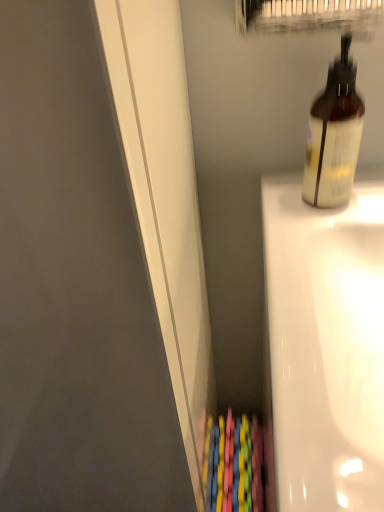
Image resolution: width=384 pixels, height=512 pixels. What do you see at coordinates (334, 136) in the screenshot?
I see `translucent plastic bottle at upper right` at bounding box center [334, 136].

Find the location of `translucent plastic bottle at upper right`. translucent plastic bottle at upper right is located at coordinates point(334,136).

Describe the element at coordinates (326, 346) in the screenshot. I see `white glossy bathtub at right` at that location.

At what (x,y) coordinates should I click in order to perform the action: click on white glossy bathtub at right. Please return your answer as a coordinate pair (x, y). Looking at the image, I should click on (326, 346).

The width and height of the screenshot is (384, 512). In order to click on translucent plastic bottle at upper right in this screenshot , I will do `click(334, 136)`.

Between translucent plastic bottle at upper right and white glossy bathtub at right, which one appears on the left side from the viewer's perspective?

Positioned to the left is translucent plastic bottle at upper right.

Which object is closer to the camera, translucent plastic bottle at upper right or white glossy bathtub at right?

white glossy bathtub at right is more forward.

Considering the points (331, 71) and (368, 359), which point is in front, point (331, 71) or point (368, 359)?

Positioned in front is point (368, 359).

From the image's perspective, which object appears higher, translucent plastic bottle at upper right or white glossy bathtub at right?

translucent plastic bottle at upper right appears higher in the image.

From a real-world perspective, which is physically below, translucent plastic bottle at upper right or white glossy bathtub at right?

From a 3D spatial view, white glossy bathtub at right is below.

Considering the relative sizes of translucent plastic bottle at upper right and white glossy bathtub at right in the image provided, is translucent plastic bottle at upper right thinner than white glossy bathtub at right?

Yes, translucent plastic bottle at upper right is thinner than white glossy bathtub at right.

From their relative heights in the image, would you say translucent plastic bottle at upper right is taller or shorter than white glossy bathtub at right?

Considering their sizes, translucent plastic bottle at upper right has less height than white glossy bathtub at right.

Looking at this image, who is bigger, translucent plastic bottle at upper right or white glossy bathtub at right?

With larger size is white glossy bathtub at right.

Is white glossy bathtub at right surrounded by translucent plastic bottle at upper right?

No.

Are translucent plastic bottle at upper right and white glossy bathtub at right making contact?

No, translucent plastic bottle at upper right is not touching white glossy bathtub at right.

Is translucent plastic bottle at upper right oriented towards white glossy bathtub at right?

No, translucent plastic bottle at upper right does not turn towards white glossy bathtub at right.

Locate an element on the screen. bottle above the white glossy bathtub at right (from the image's perspective) is located at coordinates (334, 136).

Which object is positioned more to the left, white glossy bathtub at right or translucent plastic bottle at upper right?

translucent plastic bottle at upper right.

Is white glossy bathtub at right in front of or behind translucent plastic bottle at upper right in the image?

white glossy bathtub at right is in front of translucent plastic bottle at upper right.

Considering the points (336, 501) and (306, 172), which point is in front, point (336, 501) or point (306, 172)?

The point (336, 501) is more forward.

From the image's perspective, is white glossy bathtub at right positioned above or below translucent plastic bottle at upper right?

Based on their image positions, white glossy bathtub at right is located beneath translucent plastic bottle at upper right.

From a real-world perspective, which is physically above, white glossy bathtub at right or translucent plastic bottle at upper right?

translucent plastic bottle at upper right.

Considering the relative sizes of white glossy bathtub at right and translucent plastic bottle at upper right in the image provided, is white glossy bathtub at right thinner than translucent plastic bottle at upper right?

No.

From their relative heights in the image, would you say white glossy bathtub at right is taller or shorter than translucent plastic bottle at upper right?

Clearly, white glossy bathtub at right is taller compared to translucent plastic bottle at upper right.

Considering the relative sizes of white glossy bathtub at right and translucent plastic bottle at upper right in the image provided, is white glossy bathtub at right bigger than translucent plastic bottle at upper right?

Yes, white glossy bathtub at right is bigger than translucent plastic bottle at upper right.

Do you think white glossy bathtub at right is within translucent plastic bottle at upper right, or outside of it?

white glossy bathtub at right lies outside translucent plastic bottle at upper right.

Is white glossy bathtub at right directly adjacent to translucent plastic bottle at upper right?

white glossy bathtub at right is not next to translucent plastic bottle at upper right, and they're not touching.

Looking at this image, is white glossy bathtub at right oriented towards translucent plastic bottle at upper right?

No, white glossy bathtub at right does not turn towards translucent plastic bottle at upper right.

What's the angular difference between white glossy bathtub at right and translucent plastic bottle at upper right's facing directions?

They differ by 37.4 degrees in their facing directions.

I want to click on bottle on the left of white glossy bathtub at right, so click(334, 136).

Locate an element on the screen. This screenshot has width=384, height=512. bottle above the white glossy bathtub at right (from a real-world perspective) is located at coordinates (334, 136).

Where is `bath that appears in front of the translucent plastic bottle at upper right`? bath that appears in front of the translucent plastic bottle at upper right is located at coordinates (326, 346).